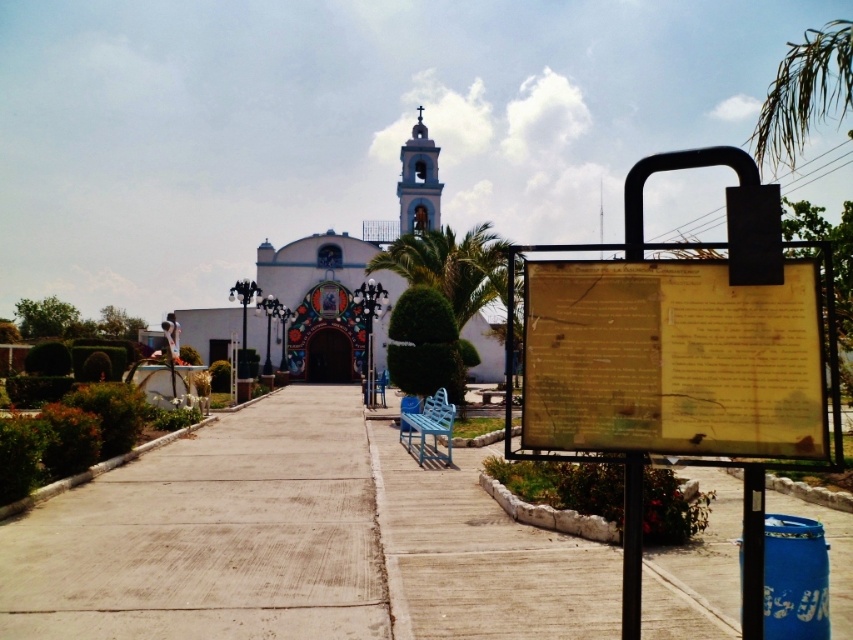
You are a tourist holding a map and standing at the plaza. You see the gray concrete pavement at center and the yellow paper sign at center. Which object is bigger in size?

The gray concrete pavement at center is larger in size than the yellow paper sign at center.

You are standing at the plaza looking towards the church entrance. There are two points marked in the image, one at coordinate point (450,548) and another at point (274,250). Which point is closer to your current position?

Point (450,548) is closer to the camera than point (274,250), so the point at coordinate point (450,548) is closer to your current position.

You are a tourist standing at the entrance of the plaza and see the yellow paper sign at center and the concrete at center. Which object is positioned higher relative to the other?

The yellow paper sign at center is located above concrete at center, so it is positioned higher than the concrete at center.